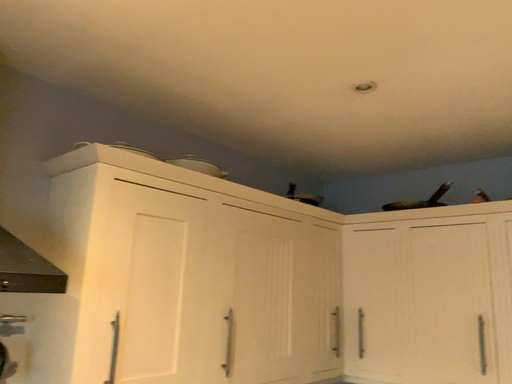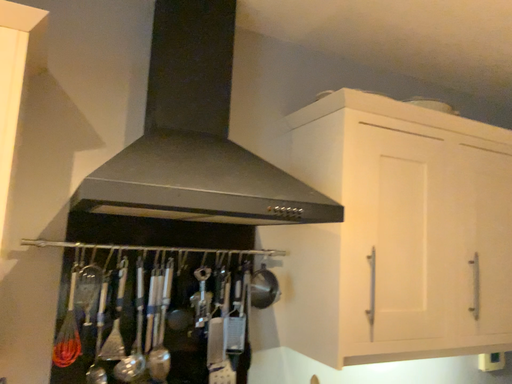
Question: Which way did the camera rotate in the video?

Choices:
 (A) rotated left
 (B) rotated right

Answer: (A)